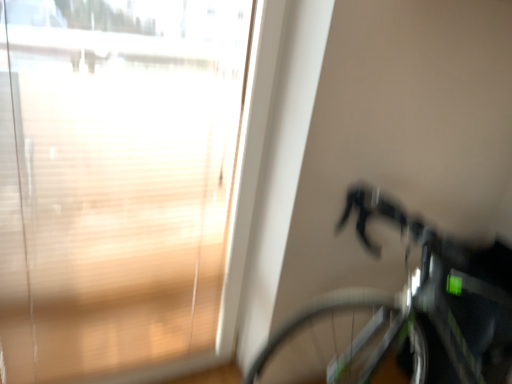
This screenshot has width=512, height=384. I want to click on transparent glass window at upper left, so click(x=115, y=179).

What do you see at coordinates (115, 179) in the screenshot? I see `transparent glass window at upper left` at bounding box center [115, 179].

This screenshot has width=512, height=384. What do you see at coordinates (403, 316) in the screenshot? I see `shiny black bicycle at right` at bounding box center [403, 316].

The image size is (512, 384). I want to click on shiny black bicycle at right, so pyautogui.click(x=403, y=316).

In order to face shiny black bicycle at right, should I rotate leftwards or rightwards?

Rotate your view right by about 24.765°.

This screenshot has width=512, height=384. Find the location of `transparent glass window at upper left`. transparent glass window at upper left is located at coordinates (115, 179).

Considering the positions of objects shiny black bicycle at right and transparent glass window at upper left in the image provided, who is more to the left, shiny black bicycle at right or transparent glass window at upper left?

transparent glass window at upper left is more to the left.

Who is more distant, shiny black bicycle at right or transparent glass window at upper left?

transparent glass window at upper left is further from the camera.

Is point (434, 307) closer or farther from the camera than point (1, 54)?

Point (434, 307).

From the image's perspective, relative to transparent glass window at upper left, is shiny black bicycle at right above or below?

From the image's perspective, shiny black bicycle at right appears below transparent glass window at upper left.

From a real-world perspective, relative to transparent glass window at upper left, is shiny black bicycle at right vertically above or below?

Clearly, from a real-world perspective, shiny black bicycle at right is below transparent glass window at upper left.

Considering the relative sizes of shiny black bicycle at right and transparent glass window at upper left in the image provided, is shiny black bicycle at right thinner than transparent glass window at upper left?

No.

Does shiny black bicycle at right have a lesser height compared to transparent glass window at upper left?

Indeed, shiny black bicycle at right has a lesser height compared to transparent glass window at upper left.

Looking at this image, who is bigger, shiny black bicycle at right or transparent glass window at upper left?

With larger size is shiny black bicycle at right.

Is shiny black bicycle at right outside of transparent glass window at upper left?

Yes.

Looking at this image, is shiny black bicycle at right directly adjacent to transparent glass window at upper left?

shiny black bicycle at right is not next to transparent glass window at upper left, and they're not touching.

Could you tell me if shiny black bicycle at right is turned towards transparent glass window at upper left?

No, shiny black bicycle at right is not oriented towards transparent glass window at upper left.

Based on the photo, can you tell me how much shiny black bicycle at right and transparent glass window at upper left differ in facing direction?

The facing directions of shiny black bicycle at right and transparent glass window at upper left are 91.2 degrees apart.

How much distance is there between shiny black bicycle at right and transparent glass window at upper left?

shiny black bicycle at right and transparent glass window at upper left are 30.93 inches apart from each other.

Identify the location of window behind the shiny black bicycle at right. Image resolution: width=512 pixels, height=384 pixels. (115, 179).

Would you say transparent glass window at upper left is to the left or to the right of shiny black bicycle at right in the picture?

Clearly, transparent glass window at upper left is on the left of shiny black bicycle at right in the image.

Considering the relative positions of transparent glass window at upper left and shiny black bicycle at right in the image provided, is transparent glass window at upper left in front of shiny black bicycle at right?

No, transparent glass window at upper left is further to the viewer.

Which is behind, point (109, 215) or point (429, 292)?

The point (109, 215) is farther.

From the image's perspective, which is below, transparent glass window at upper left or shiny black bicycle at right?

shiny black bicycle at right appears lower in the image.

From a real-world perspective, is transparent glass window at upper left beneath shiny black bicycle at right?

No.

Which of these two, transparent glass window at upper left or shiny black bicycle at right, is wider?

With larger width is shiny black bicycle at right.

Can you confirm if transparent glass window at upper left is shorter than shiny black bicycle at right?

No.

Is transparent glass window at upper left smaller than shiny black bicycle at right?

Yes.

Is transparent glass window at upper left surrounding shiny black bicycle at right?

No, shiny black bicycle at right is not inside transparent glass window at upper left.

Is transparent glass window at upper left not close to shiny black bicycle at right?

No, transparent glass window at upper left is not far from shiny black bicycle at right.

Is transparent glass window at upper left oriented away from shiny black bicycle at right?

No.

Can you tell me how much transparent glass window at upper left and shiny black bicycle at right differ in facing direction?

The facing directions of transparent glass window at upper left and shiny black bicycle at right are 91.2 degrees apart.

Where is `window on the left of shiny black bicycle at right`? Image resolution: width=512 pixels, height=384 pixels. window on the left of shiny black bicycle at right is located at coordinates (115, 179).

Locate an element on the screen. Image resolution: width=512 pixels, height=384 pixels. bicycle in front of the transparent glass window at upper left is located at coordinates (403, 316).

Identify the location of window above the shiny black bicycle at right (from the image's perspective). This screenshot has width=512, height=384. (115, 179).